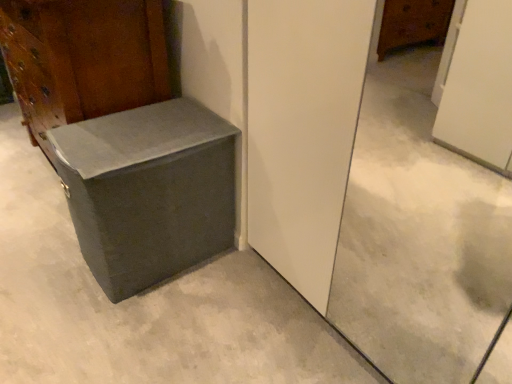
Question: From a real-world perspective, is gray concrete at center physically located above or below matte gray cardboard box at lower left?

Choices:
 (A) below
 (B) above

Answer: (A)

Question: Considering the positions of gray concrete at center and matte gray cardboard box at lower left in the image, is gray concrete at center bigger or smaller than matte gray cardboard box at lower left?

Choices:
 (A) small
 (B) big

Answer: (B)

Question: Estimate the real-world distances between objects in this image. Which object is farther from the matte gray trunk at lower left?

Choices:
 (A) gray concrete at center
 (B) matte gray cardboard box at lower left

Answer: (A)

Question: Estimate the real-world distances between objects in this image. Which object is farther from the gray concrete at center?

Choices:
 (A) matte gray trunk at lower left
 (B) matte gray cardboard box at lower left

Answer: (A)